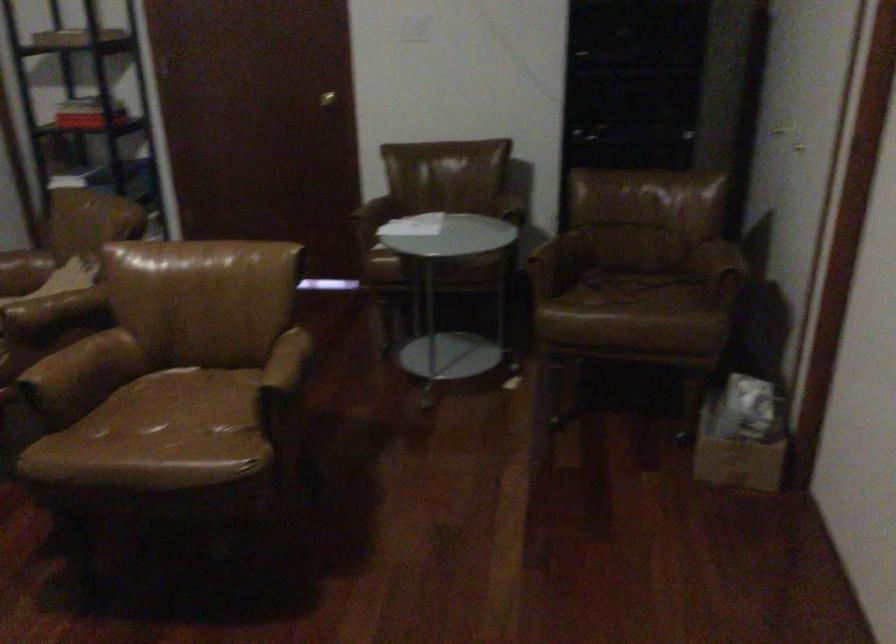
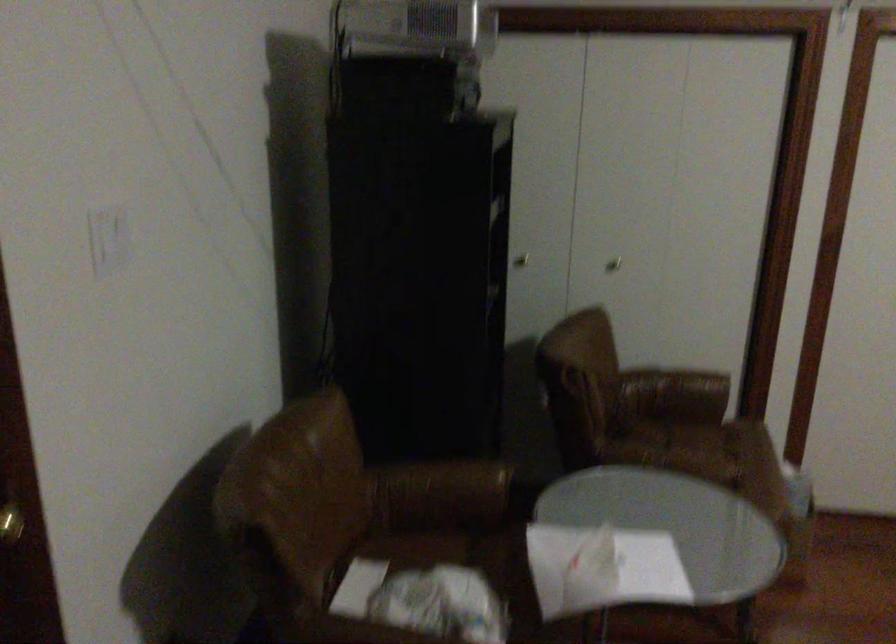
Locate, in the second image, the point that corresponds to [796,152] in the first image.

(613, 263)